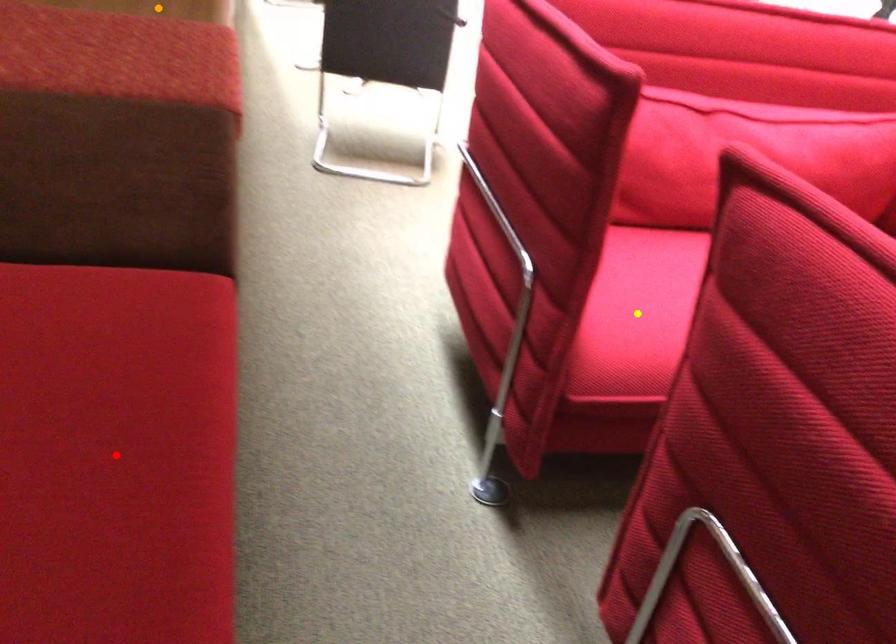
Order these from nearest to farthest:
A) orange point
B) yellow point
C) red point

orange point, yellow point, red point